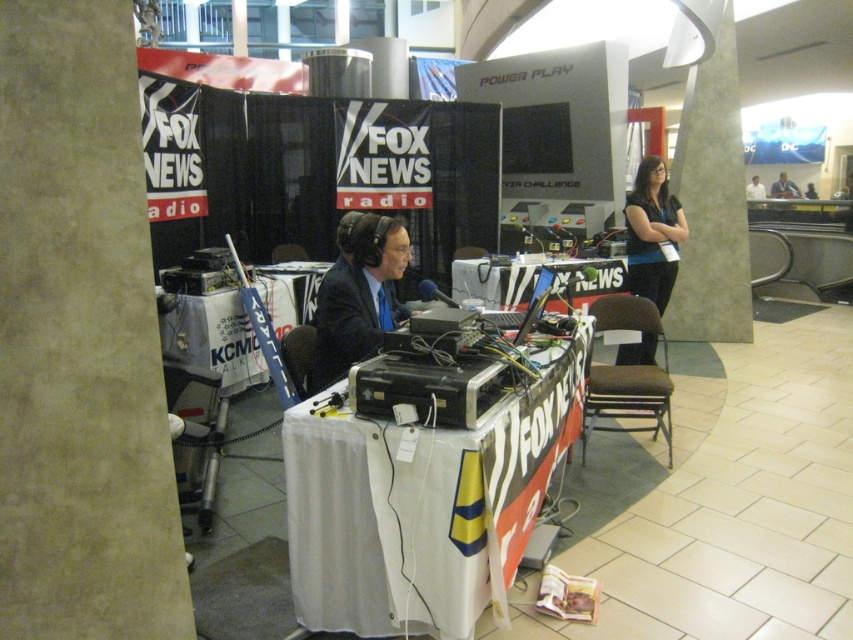
Does blue denim shirt at right have a lesser height compared to black glossy shirt at upper center?

Indeed, blue denim shirt at right has a lesser height compared to black glossy shirt at upper center.

Looking at this image, between blue denim shirt at right and black glossy shirt at upper center, which one is positioned lower?

blue denim shirt at right

Describe the element at coordinates (653, 232) in the screenshot. I see `blue denim shirt at right` at that location.

Identify the location of blue denim shirt at right. (653, 232).

From the picture: Who is more forward, (334, 422) or (666, 214)?

Point (334, 422) is in front.

This screenshot has height=640, width=853. Identify the location of white fabric table at center. (422, 504).

Where is `white fabric table at center`? The image size is (853, 640). white fabric table at center is located at coordinates (422, 504).

Between smooth black shirt at upper right and black glossy shirt at upper center, which one has more height?

With more height is black glossy shirt at upper center.

Between smooth black shirt at upper right and black glossy shirt at upper center, which one appears on the right side from the viewer's perspective?

smooth black shirt at upper right is more to the right.

Find the location of a particular element. Image resolution: width=853 pixels, height=640 pixels. smooth black shirt at upper right is located at coordinates (784, 188).

Find the location of a particular element. The height and width of the screenshot is (640, 853). smooth black shirt at upper right is located at coordinates (784, 188).